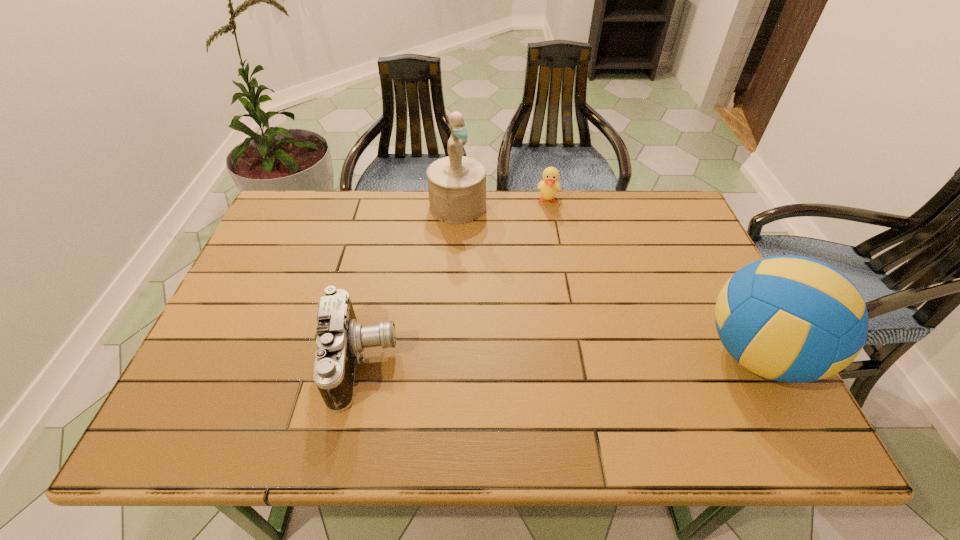
This screenshot has height=540, width=960. I want to click on the leftmost object, so click(340, 339).

Where is `the second tallest object`? the second tallest object is located at coordinates (793, 319).

The width and height of the screenshot is (960, 540). In order to click on the rightmost object in this screenshot , I will do `click(793, 319)`.

Locate an element on the screen. This screenshot has width=960, height=540. figurine is located at coordinates (456, 184).

Identify the location of the second object from left to right. (456, 184).

Identify the location of duckling. (550, 186).

Locate an element on the screen. Image resolution: width=960 pixels, height=540 pixels. vacant space positioned at the lens of the leftmost object is located at coordinates (540, 362).

Locate an element on the screen. The width and height of the screenshot is (960, 540). vacant space located on the left of the third shortest object is located at coordinates point(526,354).

The height and width of the screenshot is (540, 960). What are the coordinates of `vacant space situated at the beak of the figurine` in the screenshot? It's located at (487, 246).

Locate an element on the screen. vacant position located 0.370m at the beak of the figurine is located at coordinates (530, 306).